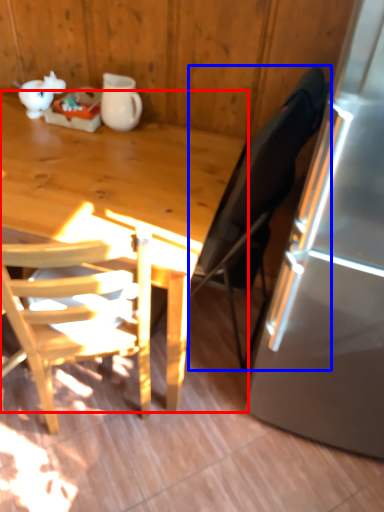
Question: Which of the following is the closest to the observer, desk (highlighted by a red box) or chair (highlighted by a blue box)?

Choices:
 (A) desk
 (B) chair

Answer: (B)